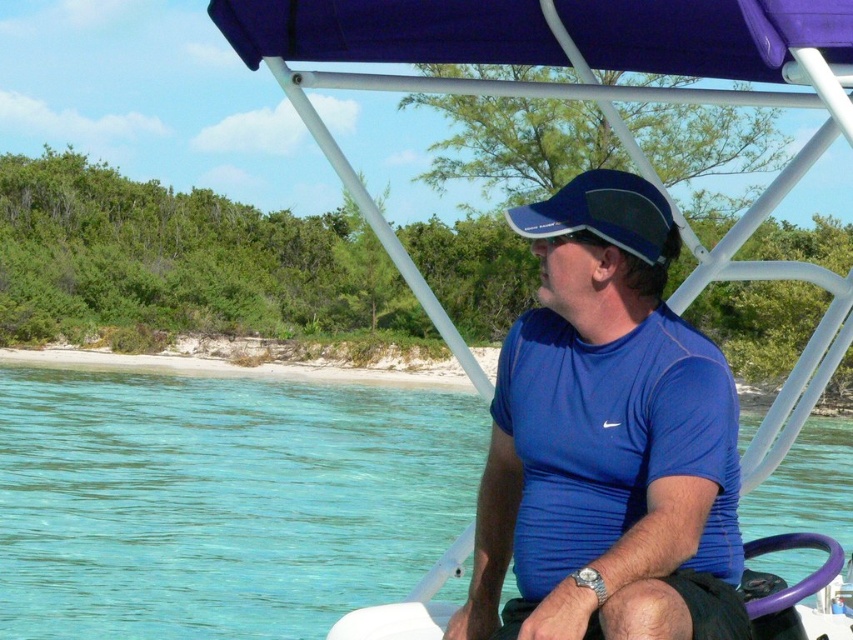
You are a photographer trying to capture a photo of the clear blue water at center and the blue mesh baseball cap at center. Which object is higher in the image?

The clear blue water at center is much taller than the blue mesh baseball cap at center, so the clear blue water at center is higher in the image.

You are a swimmer who wants to jump into the water. Considering the sizes of the clear blue water at center and the blue mesh shirt at center, which one would you choose to jump into and why?

The clear blue water at center has a larger size compared to the blue mesh shirt at center, so you should jump into the clear blue water at center because it is bigger and safer for swimming.

You are navigating a boat and need to avoid shallow areas. According to the coordinates provided, where is the clear blue water at center located?

The clear blue water at center is located at point (219, 500), which indicates its position in the image for navigation purposes.